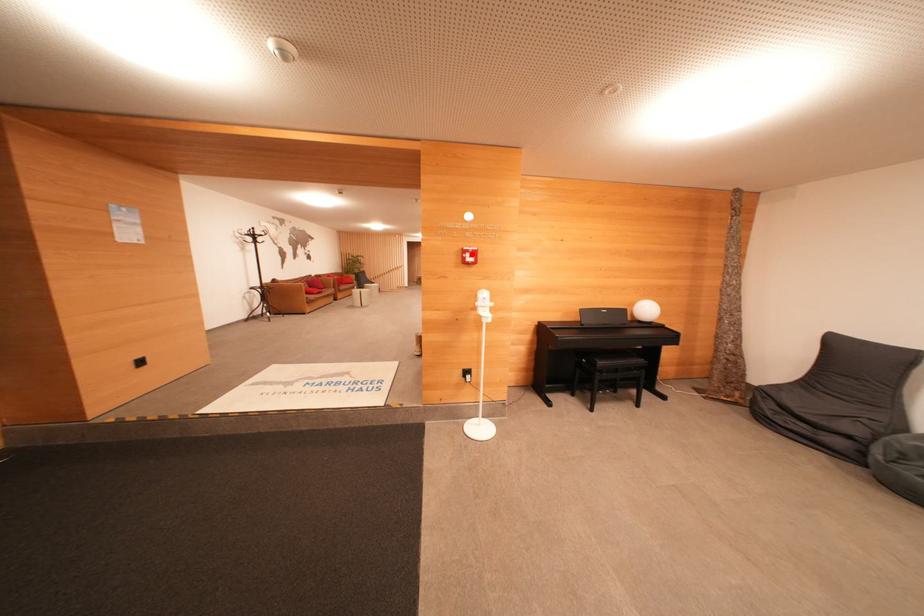
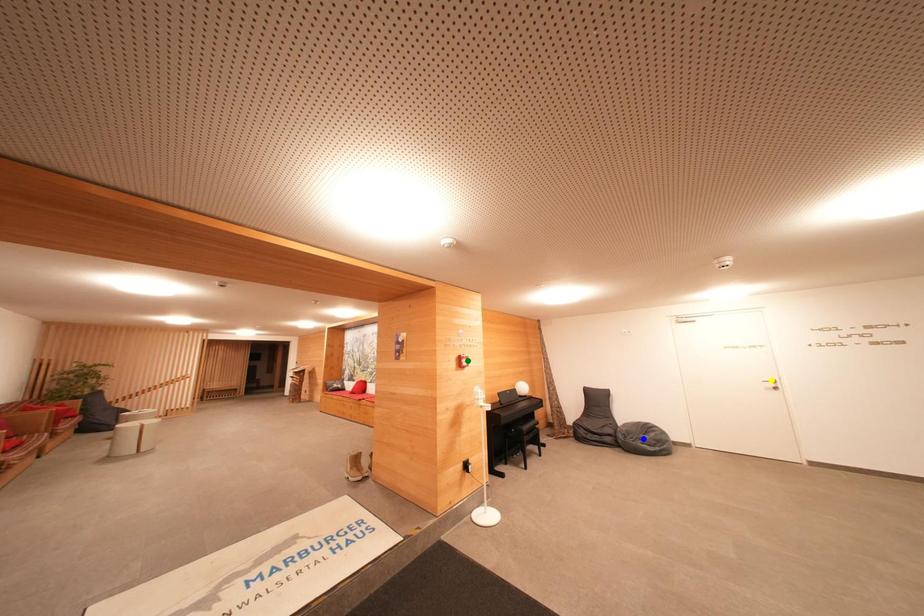
Question: I am providing you with two images of the same scene from different viewpoints. A red point is marked on the first image. You are given multiple points on the second image. Which spot in image 2 lines up with the point in image 1?

Choices:
 (A) blue point
 (B) green point
 (C) yellow point

Answer: (B)